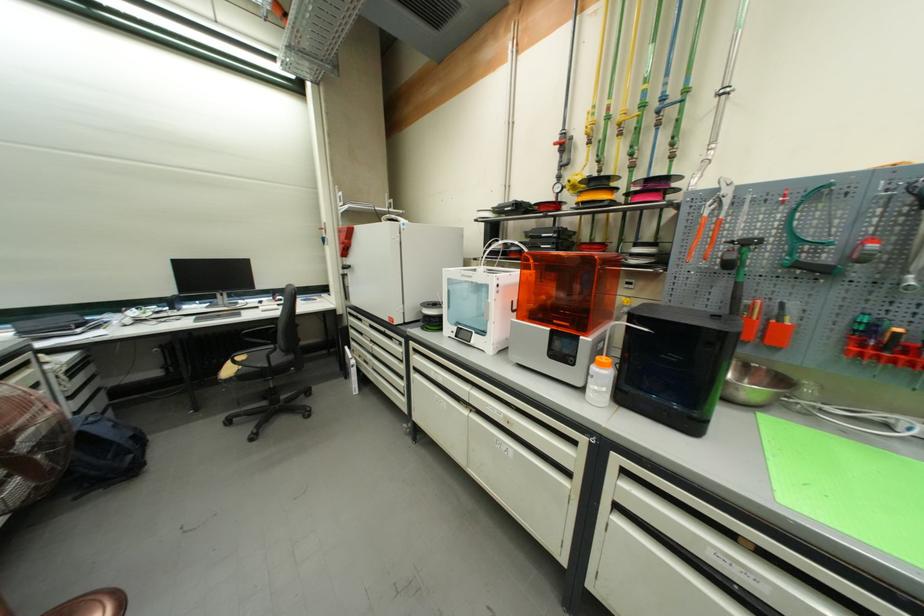
The height and width of the screenshot is (616, 924). I want to click on yellow valve handle, so click(575, 177).